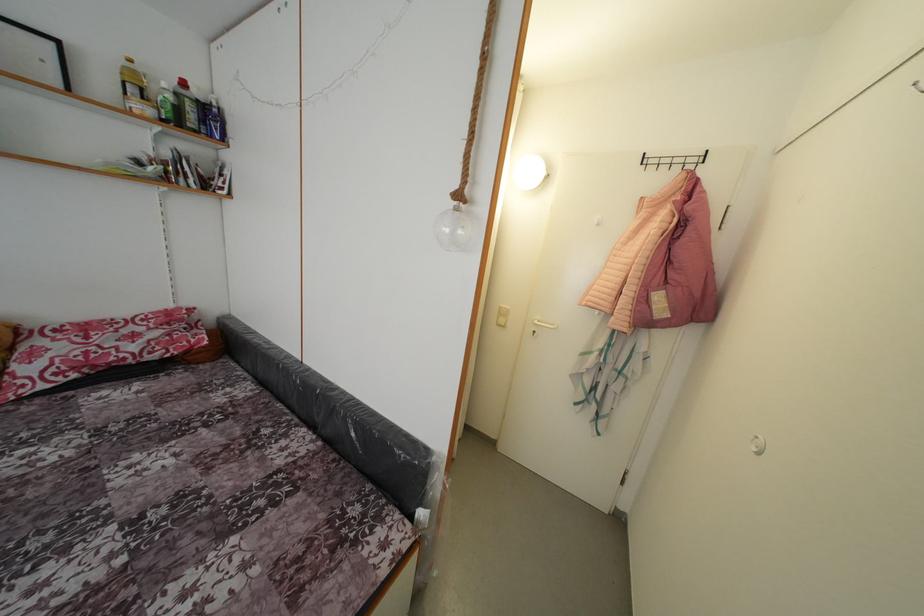
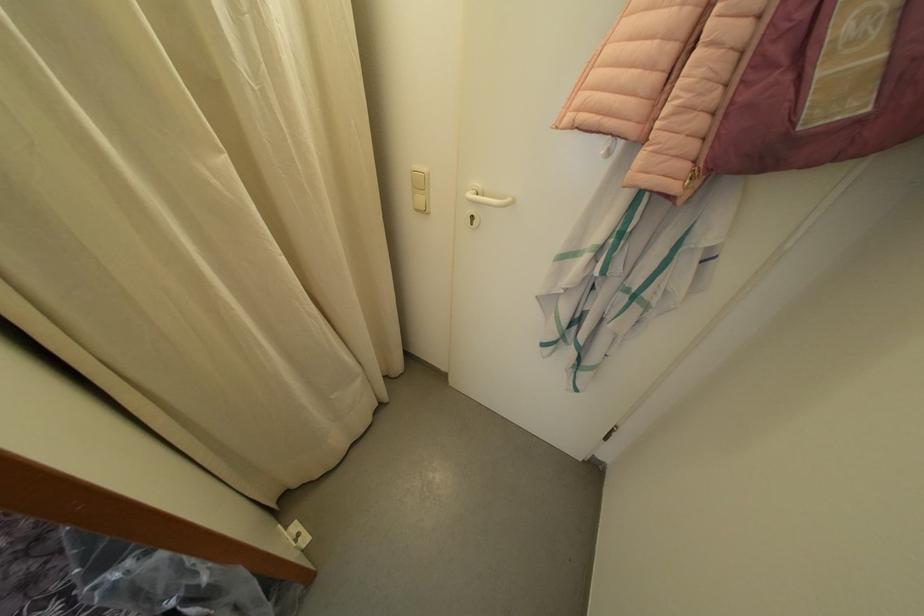
Find the pixel in the second image that matches the point at 543,323 in the first image.

(482, 190)